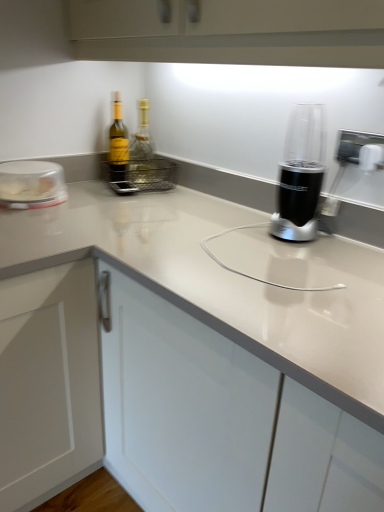
Measure the distance between black plastic blender at center and camera.

The distance of black plastic blender at center from camera is 1.07 meters.

In order to face white glossy countertop at center, should I rotate leftwards or rightwards?

Turn left by 13.574 degrees to look at white glossy countertop at center.

Identify the location of green glass bottle at upper left, acting as the 1th bottle starting from the left. (118, 144).

Could you tell me if white glossy countertop at center is turned towards translucent glass bottle at center, the first bottle positioned from the right?

No, white glossy countertop at center is not aimed at translucent glass bottle at center, the first bottle positioned from the right.

Between white glossy countertop at center and translucent glass bottle at center, the first bottle positioned from the right, which one appears on the left side from the viewer's perspective?

white glossy countertop at center is more to the left.

Can we say white glossy countertop at center lies outside translucent glass bottle at center, which appears as the 2th bottle when viewed from the left?

Yes, white glossy countertop at center is not within translucent glass bottle at center, which appears as the 2th bottle when viewed from the left.

Which bottle is the 2nd one when counting from the back of the white glossy countertop at center? Please provide its 2D coordinates.

[(142, 149)]

From the image's perspective, would you say translucent glass bottle at center, the first bottle positioned from the right, is positioned over clear plastic container at left?

Yes, from the image's perspective, translucent glass bottle at center, the first bottle positioned from the right, is on top of clear plastic container at left.

Between point (141, 102) and point (56, 203), which one is positioned in front?

The point (56, 203) is in front.

How many degrees apart are the facing directions of translucent glass bottle at center, which appears as the 2th bottle when viewed from the left, and clear plastic container at left?

36.1 degrees separate the facing orientations of translucent glass bottle at center, which appears as the 2th bottle when viewed from the left, and clear plastic container at left.

Considering the relative sizes of black plastic blender at center and translucent glass bottle at center, which appears as the 2th bottle when viewed from the left, in the image provided, is black plastic blender at center bigger than translucent glass bottle at center, which appears as the 2th bottle when viewed from the left,?

Indeed, black plastic blender at center has a larger size compared to translucent glass bottle at center, which appears as the 2th bottle when viewed from the left.

Which of these two, black plastic blender at center or translucent glass bottle at center, which appears as the 2th bottle when viewed from the left, stands taller?

translucent glass bottle at center, which appears as the 2th bottle when viewed from the left, is taller.

From the picture: Is green glass bottle at upper left, which is the second bottle from right to left, with black plastic blender at center?

green glass bottle at upper left, which is the second bottle from right to left, and black plastic blender at center are not in contact.

Is green glass bottle at upper left, which is the second bottle from right to left, wider or thinner than black plastic blender at center?

green glass bottle at upper left, which is the second bottle from right to left, is thinner than black plastic blender at center.

Consider the image. Can we say green glass bottle at upper left, acting as the 1th bottle starting from the left, lies outside black plastic blender at center?

Yes, green glass bottle at upper left, acting as the 1th bottle starting from the left, is located beyond the bounds of black plastic blender at center.

Is black plastic blender at center at the back of green glass bottle at upper left, which is the second bottle from right to left?

No, green glass bottle at upper left, which is the second bottle from right to left,'s orientation is not away from black plastic blender at center.

From the image's perspective, count 1st bottles upward from the white glossy countertop at center and point to it. Please provide its 2D coordinates.

[(118, 144)]

Between point (110, 135) and point (175, 244), which one is positioned in front?

The point (175, 244) is closer to the camera.

Is green glass bottle at upper left, which is the second bottle from right to left, not close to white glossy countertop at center?

No.

Considering the sizes of objects green glass bottle at upper left, which is the second bottle from right to left, and white glossy countertop at center in the image provided, who is bigger, green glass bottle at upper left, which is the second bottle from right to left, or white glossy countertop at center?

With larger size is white glossy countertop at center.

Which is further, (309, 382) or (316, 160)?

Positioned behind is point (316, 160).

Does white glossy countertop at center have a greater height compared to black plastic blender at center?

Indeed, white glossy countertop at center has a greater height compared to black plastic blender at center.

In terms of width, does white glossy countertop at center look wider or thinner when compared to black plastic blender at center?

In the image, white glossy countertop at center appears to be wider than black plastic blender at center.

Locate an element on the screen. The height and width of the screenshot is (512, 384). counter top below the translucent glass bottle at center, the first bottle positioned from the right (from the image's perspective) is located at coordinates (225, 283).

Is translucent glass bottle at center, the first bottle positioned from the right, looking in the opposite direction of white glossy countertop at center?

No, translucent glass bottle at center, the first bottle positioned from the right, is not facing away from white glossy countertop at center.

Consider the image. Which of these two, translucent glass bottle at center, the first bottle positioned from the right, or white glossy countertop at center, is bigger?

white glossy countertop at center.

From a real-world perspective, does translucent glass bottle at center, the first bottle positioned from the right, stand above white glossy countertop at center?

Yes, from a real-world perspective, translucent glass bottle at center, the first bottle positioned from the right, is above white glossy countertop at center.

At what (x,y) coordinates should I click in order to perform the action: click on counter top in front of the translucent glass bottle at center, the first bottle positioned from the right. Please return your answer as a coordinate pair (x, y). Looking at the image, I should click on (225, 283).

You are a GUI agent. You are given a task and a screenshot of the screen. Output one action in this format:
    pyautogui.click(x=<x>, y=<y>)
    Task: Click on the kitchen appliance on the left of translucent glass bottle at center, the first bottle positioned from the right
    
    Given the screenshot: What is the action you would take?
    pyautogui.click(x=31, y=184)

From the picture: Estimate the real-world distances between objects in this image. Which object is closer to white glossy countertop at center, black plastic blender at center or green glass bottle at upper left, acting as the 1th bottle starting from the left?

Among the two, black plastic blender at center is located nearer to white glossy countertop at center.

Estimate the real-world distances between objects in this image. Which object is further from clear plastic container at left, white glossy countertop at center or green glass bottle at upper left, acting as the 1th bottle starting from the left?

white glossy countertop at center lies further to clear plastic container at left than the other object.

Looking at the image, which one is located closer to clear plastic container at left, black plastic blender at center or white glossy countertop at center?

Based on the image, white glossy countertop at center appears to be nearer to clear plastic container at left.

Estimate the real-world distances between objects in this image. Which object is closer to translucent glass bottle at center, the first bottle positioned from the right, black plastic blender at center or green glass bottle at upper left, which is the second bottle from right to left?

green glass bottle at upper left, which is the second bottle from right to left, is closer to translucent glass bottle at center, the first bottle positioned from the right.

Based on the photo, based on their spatial positions, is translucent glass bottle at center, which appears as the 2th bottle when viewed from the left, or white glossy countertop at center further from green glass bottle at upper left, which is the second bottle from right to left?

white glossy countertop at center.

Estimate the real-world distances between objects in this image. Which object is closer to green glass bottle at upper left, acting as the 1th bottle starting from the left, translucent glass bottle at center, the first bottle positioned from the right, or black plastic blender at center?

translucent glass bottle at center, the first bottle positioned from the right, is positioned closer to the anchor green glass bottle at upper left, acting as the 1th bottle starting from the left.

Looking at the image, which one is located further to black plastic blender at center, clear plastic container at left or translucent glass bottle at center, which appears as the 2th bottle when viewed from the left?

clear plastic container at left is further to black plastic blender at center.

Which object lies nearer to the anchor point translucent glass bottle at center, the first bottle positioned from the right, white glossy countertop at center or clear plastic container at left?

Among the two, clear plastic container at left is located nearer to translucent glass bottle at center, the first bottle positioned from the right.

What are the coordinates of `bottle between clear plastic container at left and translucent glass bottle at center, the first bottle positioned from the right, along the z-axis` in the screenshot? It's located at (118, 144).

Locate an element on the screen. The image size is (384, 512). home appliance between white glossy countertop at center and green glass bottle at upper left, acting as the 1th bottle starting from the left, from front to back is located at coordinates (301, 175).

At what (x,y) coordinates should I click in order to perform the action: click on kitchen appliance between white glossy countertop at center and green glass bottle at upper left, acting as the 1th bottle starting from the left, from front to back. Please return your answer as a coordinate pair (x, y). This screenshot has width=384, height=512. Looking at the image, I should click on (31, 184).

This screenshot has height=512, width=384. In order to click on bottle positioned between black plastic blender at center and translucent glass bottle at center, which appears as the 2th bottle when viewed from the left, from near to far in this screenshot , I will do `click(118, 144)`.